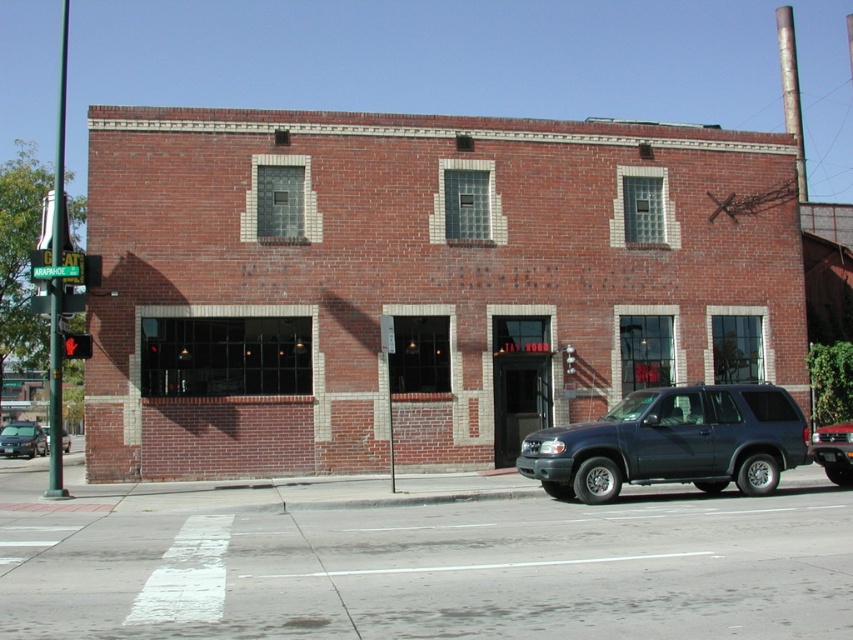
Is brick building at center shorter than red glass pedestrian signal at center?

In fact, brick building at center may be taller than red glass pedestrian signal at center.

Is brick building at center to the left of red glass pedestrian signal at center from the viewer's perspective?

In fact, brick building at center is to the right of red glass pedestrian signal at center.

Find the location of `brick building at center`. brick building at center is located at coordinates (418, 282).

Is point (421, 173) less distant than point (848, 467)?

No, (421, 173) is further to viewer.

Is brick building at center positioned before metallic blue suv at center-right?

That is False.

Between point (108, 458) and point (824, 451), which one is positioned in front?

Point (824, 451) is more forward.

The width and height of the screenshot is (853, 640). In order to click on brick building at center in this screenshot , I will do `click(418, 282)`.

Between metallic blue suv at center and matte black suv at center, which one has less height?

Standing shorter between the two is metallic blue suv at center.

Is metallic blue suv at center above matte black suv at center?

Correct, metallic blue suv at center is located above matte black suv at center.

Which is behind, point (764, 472) or point (67, 442)?

The point (67, 442) is behind.

Where is `metallic blue suv at center`? Image resolution: width=853 pixels, height=640 pixels. metallic blue suv at center is located at coordinates (672, 442).